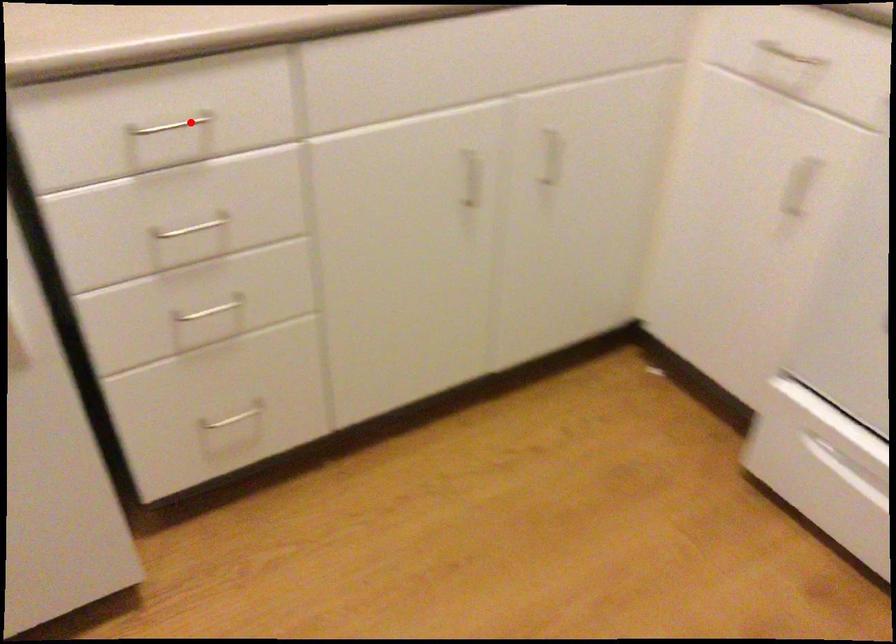
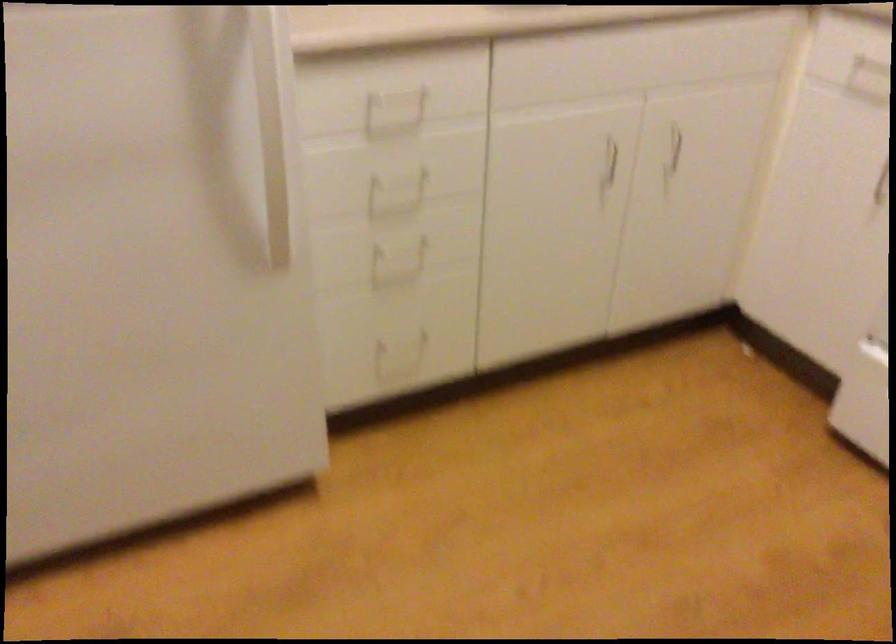
Question: A red point is marked in image1. In image2, is the corresponding 3D point closer to the camera or farther? Reply with the corresponding letter.

Choices:
 (A) The corresponding 3D point is closer.
 (B) The corresponding 3D point is farther.

Answer: (B)